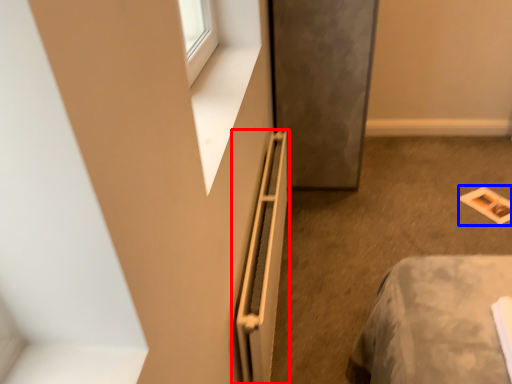
Question: Which point is further to the camera, radiator (highlighted by a red box) or magazine (highlighted by a blue box)?

Choices:
 (A) radiator
 (B) magazine

Answer: (B)